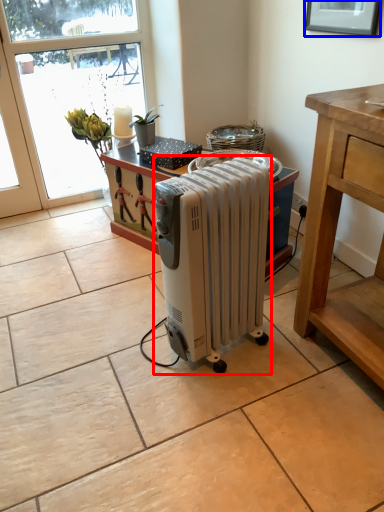
Question: Which of the following is the closest to the observer, home appliance (highlighted by a red box) or picture frame (highlighted by a blue box)?

Choices:
 (A) home appliance
 (B) picture frame

Answer: (A)